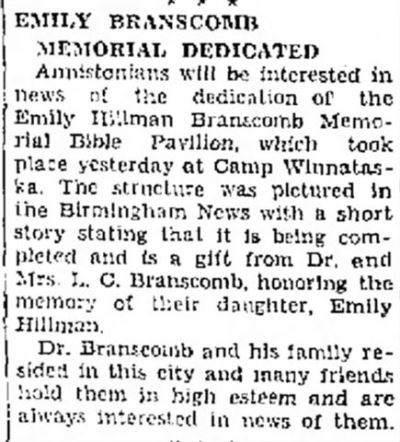
This screenshot has width=400, height=442. What are the coordinates of `typewriter` in the screenshot? It's located at (272, 201).